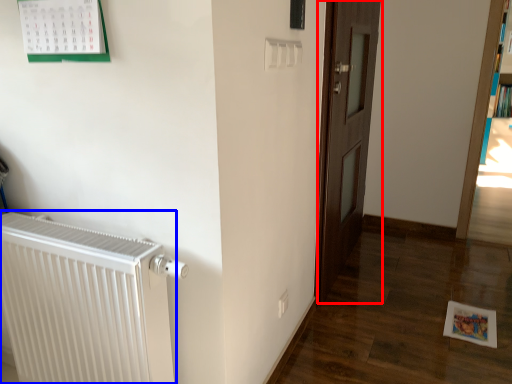
Question: Which object appears farthest to the camera in this image, door (highlighted by a red box) or radiator (highlighted by a blue box)?

Choices:
 (A) door
 (B) radiator

Answer: (A)